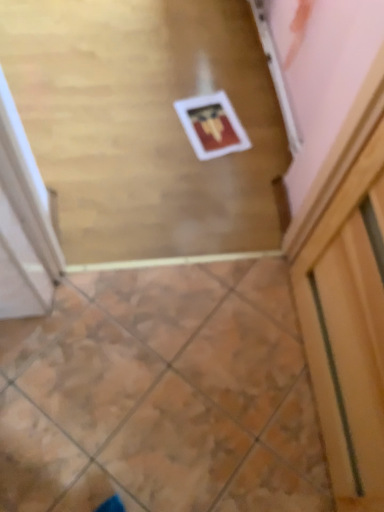
Question: Should I look upward or downward to see wooden floor at center?

Choices:
 (A) up
 (B) down

Answer: (A)